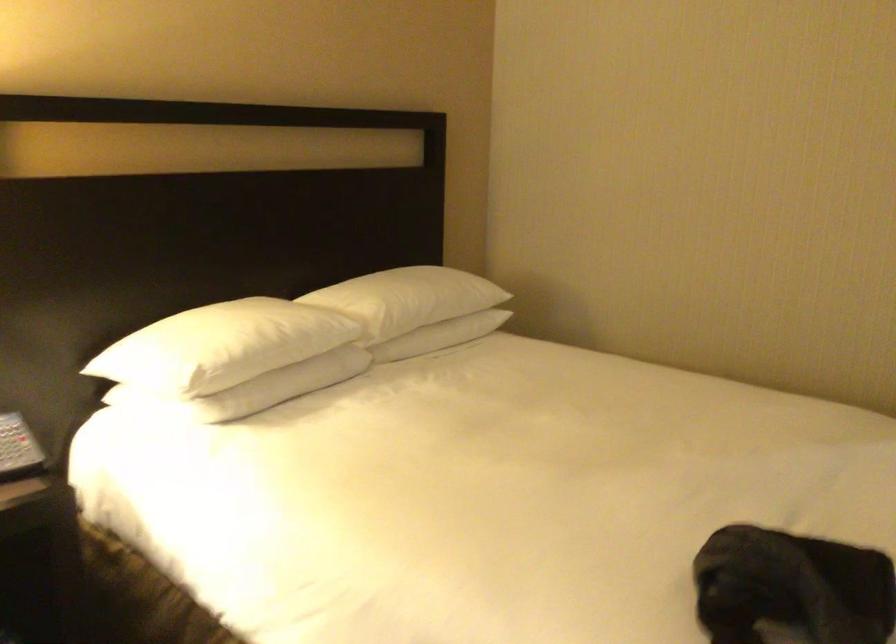
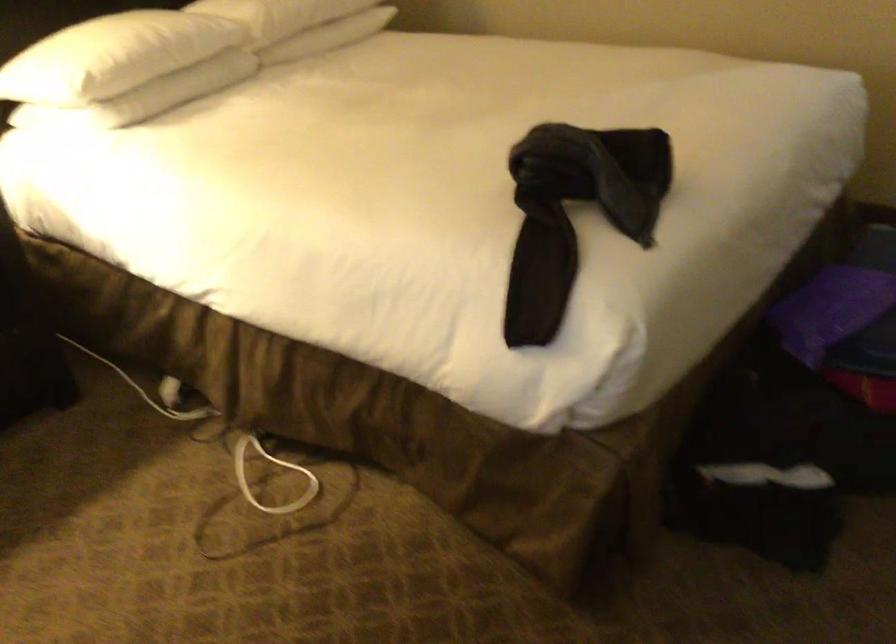
Where in the second image is the point corresponding to point 230,348 from the first image?

(112, 57)